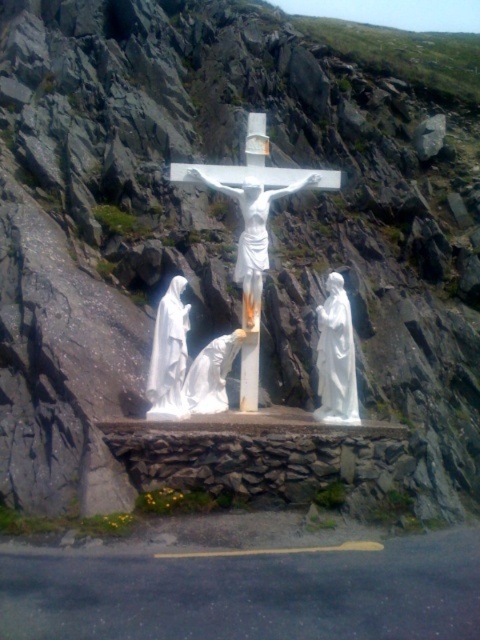
Which is in front, point (254, 301) or point (175, 392)?

Point (175, 392) is more forward.

Does white marble crucifix at center have a greater width compared to white marble statue at left?

Indeed, white marble crucifix at center has a greater width compared to white marble statue at left.

The height and width of the screenshot is (640, 480). Describe the element at coordinates (252, 237) in the screenshot. I see `white marble crucifix at center` at that location.

At what (x,y) coordinates should I click in order to perform the action: click on white marble crucifix at center. Please return your answer as a coordinate pair (x, y). This screenshot has width=480, height=640. Looking at the image, I should click on (252, 237).

Is point (243, 264) more distant than point (230, 333)?

Yes, point (243, 264) is behind point (230, 333).

Between point (252, 328) and point (220, 376), which one is positioned in front?

Point (220, 376)

Who is more distant from viewer, (259, 289) or (244, 339)?

The point (259, 289) is more distant.

In order to click on white marble crucifix at center in this screenshot , I will do point(252,237).

Is white marble statue at left above white glossy statue at center?

Yes.

Who is more distant from viewer, (x=184, y=316) or (x=207, y=364)?

The point (x=207, y=364) is more distant.

Image resolution: width=480 pixels, height=640 pixels. What are the coordinates of `white marble statue at left` in the screenshot? It's located at (168, 355).